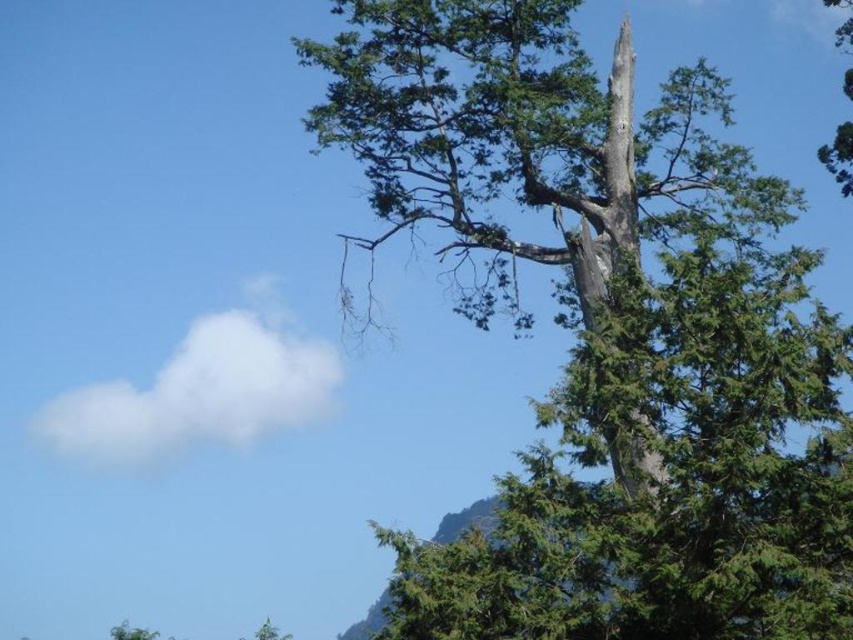
Question: Does gray bark tree trunk at upper right appear under green textured tree at upper right?

Choices:
 (A) yes
 (B) no

Answer: (A)

Question: Can you confirm if green rough bark tree at upper right is positioned above green textured tree at upper right?

Choices:
 (A) yes
 (B) no

Answer: (B)

Question: Is gray bark tree trunk at upper right closer to camera compared to green textured tree at upper right?

Choices:
 (A) no
 (B) yes

Answer: (B)

Question: Which is farther from the green textured tree at upper right?

Choices:
 (A) green rough bark tree at upper right
 (B) gray bark tree trunk at upper right

Answer: (B)

Question: Which point is closer to the camera?

Choices:
 (A) (836, 161)
 (B) (844, 493)
 (C) (648, 492)

Answer: (B)

Question: Among these objects, which one is farthest from the camera?

Choices:
 (A) green rough bark tree at upper right
 (B) green textured tree at upper right

Answer: (B)